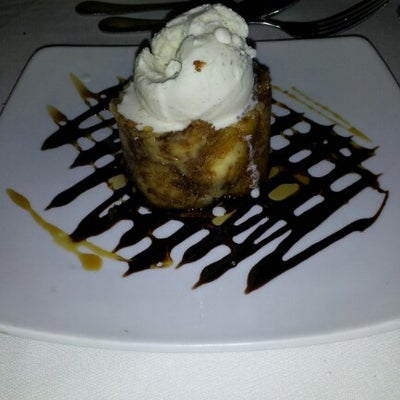
The width and height of the screenshot is (400, 400). Find the location of `spoon`. spoon is located at coordinates (272, 11).